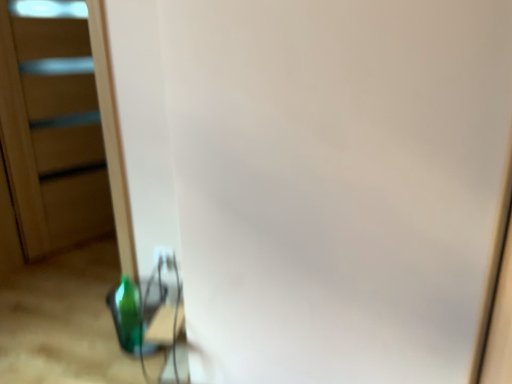
Question: From a real-world perspective, is white plastic electric outlet at lower center positioned above or below green glass bottle at lower left?

Choices:
 (A) below
 (B) above

Answer: (B)

Question: Is white plastic electric outlet at lower center wider or thinner than green glass bottle at lower left?

Choices:
 (A) thin
 (B) wide

Answer: (A)

Question: Considering the real-world distances, which object is closest to the transparent plastic screen door at left?

Choices:
 (A) green glass bottle at lower left
 (B) white plastic electric outlet at lower center

Answer: (A)

Question: Estimate the real-world distances between objects in this image. Which object is closer to the white plastic electric outlet at lower center?

Choices:
 (A) transparent plastic screen door at left
 (B) green glass bottle at lower left

Answer: (B)